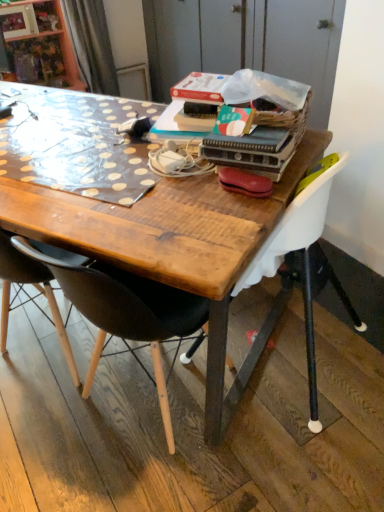
Question: Would you say black plastic chair at center, which appears as the 2th chair when viewed from the right, is outside leather-like brown handbag at center?

Choices:
 (A) yes
 (B) no

Answer: (A)

Question: Does black plastic chair at center, which appears as the 2th chair when viewed from the right, have a lesser width compared to leather-like brown handbag at center?

Choices:
 (A) yes
 (B) no

Answer: (B)

Question: Is black plastic chair at center, which is the first chair from left to right, wider than leather-like brown handbag at center?

Choices:
 (A) no
 (B) yes

Answer: (B)

Question: Does black plastic chair at center, which appears as the 2th chair when viewed from the right, come in front of leather-like brown handbag at center?

Choices:
 (A) no
 (B) yes

Answer: (B)

Question: From a real-world perspective, is black plastic chair at center, which is the first chair from left to right, under leather-like brown handbag at center?

Choices:
 (A) no
 (B) yes

Answer: (B)

Question: Is black plastic chair at center, which is the first chair from left to right, smaller than leather-like brown handbag at center?

Choices:
 (A) no
 (B) yes

Answer: (A)

Question: From a real-world perspective, is white plastic chair at upper right, placed as the second chair when sorted from left to right, over leather-like brown handbag at center?

Choices:
 (A) no
 (B) yes

Answer: (A)

Question: Could you tell me if white plastic chair at upper right, placed as the second chair when sorted from left to right, is turned towards leather-like brown handbag at center?

Choices:
 (A) yes
 (B) no

Answer: (B)

Question: Can you confirm if white plastic chair at upper right, placed as the second chair when sorted from left to right, is shorter than leather-like brown handbag at center?

Choices:
 (A) yes
 (B) no

Answer: (B)

Question: From the image's perspective, is white plastic chair at upper right, placed as the second chair when sorted from left to right, below leather-like brown handbag at center?

Choices:
 (A) yes
 (B) no

Answer: (A)

Question: Can you confirm if white plastic chair at upper right, which is the 1th chair from right to left, is positioned to the right of leather-like brown handbag at center?

Choices:
 (A) yes
 (B) no

Answer: (A)

Question: Does white plastic chair at upper right, placed as the second chair when sorted from left to right, have a larger size compared to leather-like brown handbag at center?

Choices:
 (A) no
 (B) yes

Answer: (B)

Question: From the image's perspective, is leather-like brown handbag at center on black plastic chair at center, which appears as the 2th chair when viewed from the right?

Choices:
 (A) yes
 (B) no

Answer: (A)